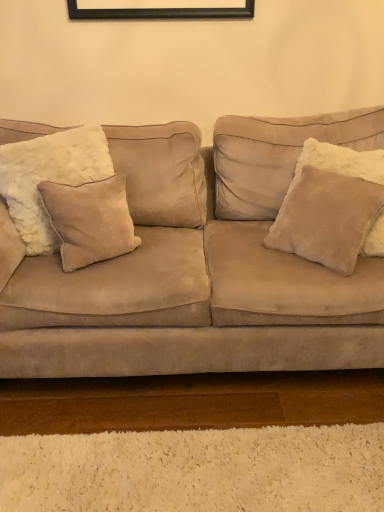
Question: Is beige suede pillow at left, which is the second pillow in right-to-left order, surrounded by suede pillow at right, positioned as the 3th pillow in left-to-right order?

Choices:
 (A) yes
 (B) no

Answer: (B)

Question: Considering the relative sizes of suede pillow at right, positioned as the 3th pillow in left-to-right order, and beige suede pillow at left, which ranks as the second pillow in left-to-right order, in the image provided, is suede pillow at right, positioned as the 3th pillow in left-to-right order, taller than beige suede pillow at left, which ranks as the second pillow in left-to-right order,?

Choices:
 (A) yes
 (B) no

Answer: (A)

Question: Does suede pillow at right, the 1th pillow in the right-to-left sequence, have a greater width compared to beige suede pillow at left, which ranks as the second pillow in left-to-right order?

Choices:
 (A) no
 (B) yes

Answer: (B)

Question: Is suede pillow at right, positioned as the 3th pillow in left-to-right order, positioned before beige suede pillow at left, which ranks as the second pillow in left-to-right order?

Choices:
 (A) no
 (B) yes

Answer: (B)

Question: Can you confirm if suede pillow at right, the 1th pillow in the right-to-left sequence, is shorter than beige suede pillow at left, which is the second pillow in right-to-left order?

Choices:
 (A) no
 (B) yes

Answer: (A)

Question: From a real-world perspective, does suede pillow at right, positioned as the 3th pillow in left-to-right order, stand above beige suede pillow at left, which is the second pillow in right-to-left order?

Choices:
 (A) no
 (B) yes

Answer: (B)

Question: From the image's perspective, is beige suede pillow at left, marked as the 1th pillow in a left-to-right arrangement, over suede pillow at right, positioned as the 3th pillow in left-to-right order?

Choices:
 (A) yes
 (B) no

Answer: (A)

Question: Can you confirm if beige suede pillow at left, marked as the 1th pillow in a left-to-right arrangement, is thinner than suede pillow at right, the 1th pillow in the right-to-left sequence?

Choices:
 (A) yes
 (B) no

Answer: (A)

Question: Does beige suede pillow at left, marked as the 1th pillow in a left-to-right arrangement, have a greater height compared to suede pillow at right, positioned as the 3th pillow in left-to-right order?

Choices:
 (A) no
 (B) yes

Answer: (B)

Question: Does beige suede pillow at left, marked as the 1th pillow in a left-to-right arrangement, have a larger size compared to suede pillow at right, the 1th pillow in the right-to-left sequence?

Choices:
 (A) yes
 (B) no

Answer: (A)

Question: From the image's perspective, is beige suede pillow at left, marked as the 1th pillow in a left-to-right arrangement, beneath suede pillow at right, positioned as the 3th pillow in left-to-right order?

Choices:
 (A) no
 (B) yes

Answer: (A)

Question: Does beige suede pillow at left, the 3th pillow viewed from the right, have a lesser height compared to suede pillow at right, the 1th pillow in the right-to-left sequence?

Choices:
 (A) yes
 (B) no

Answer: (B)

Question: Is beige suede pillow at left, which ranks as the second pillow in left-to-right order, to the left of suede couch at center from the viewer's perspective?

Choices:
 (A) no
 (B) yes

Answer: (B)